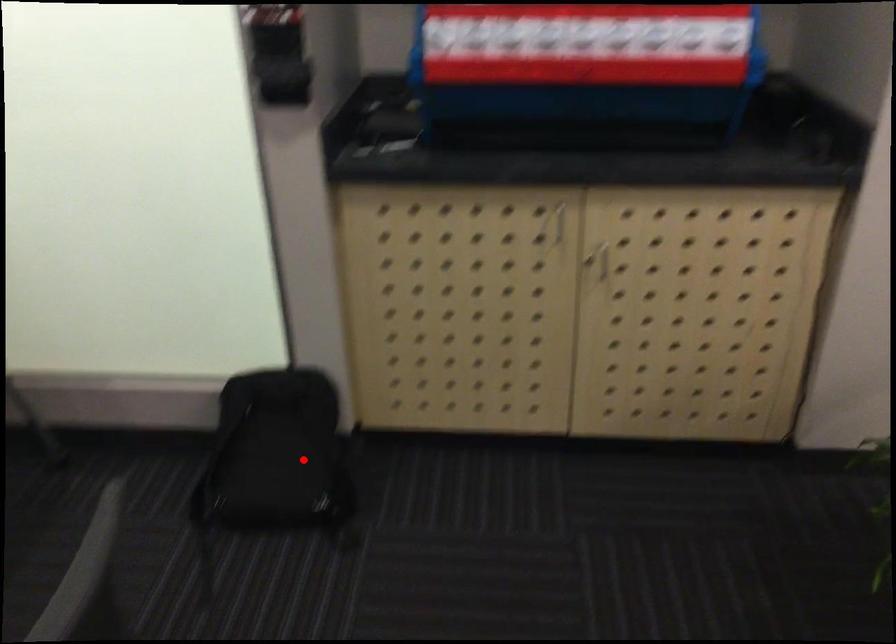
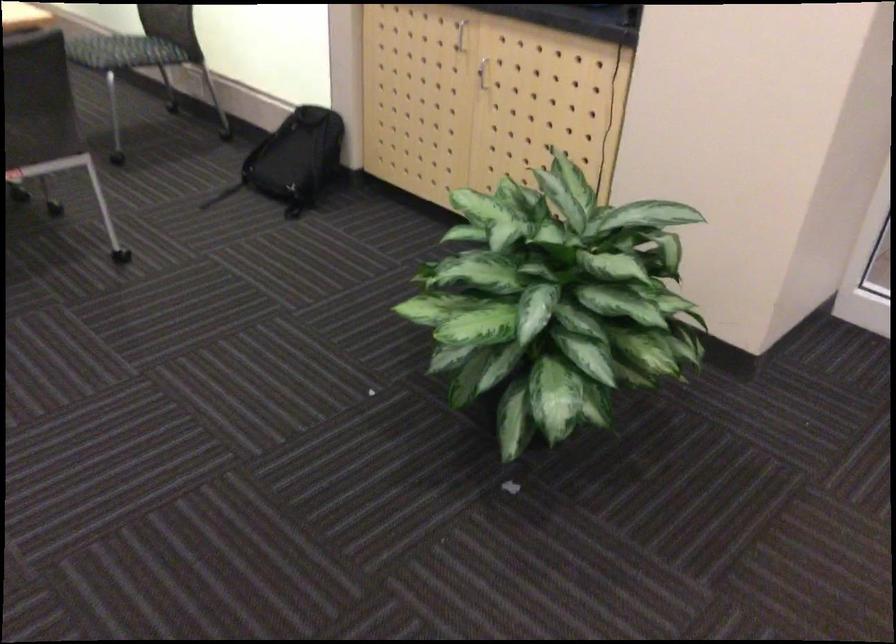
Where in the second image is the point corresponding to the highlighted location from the first image?

(293, 160)